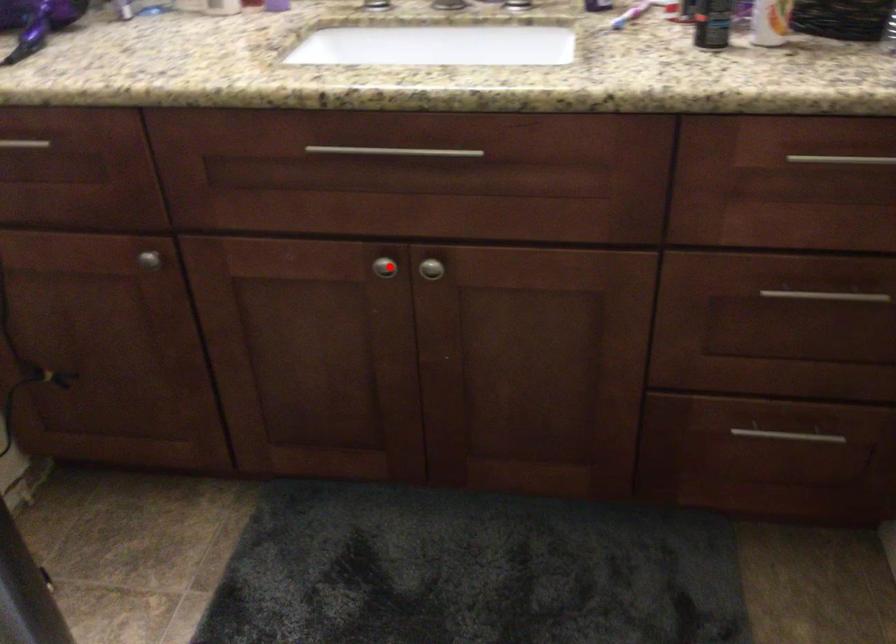
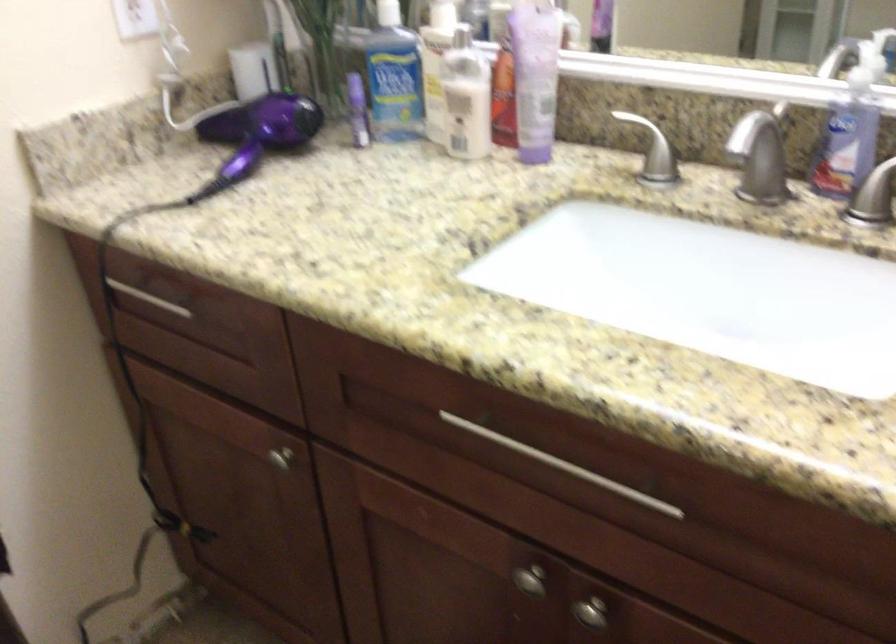
Question: I am providing you with two images of the same scene from different viewpoints. Image1 has a red point marked. In image2, the corresponding 3D location appears at what relative position? Reply with the corresponding letter.

Choices:
 (A) Closer
 (B) Farther

Answer: (A)